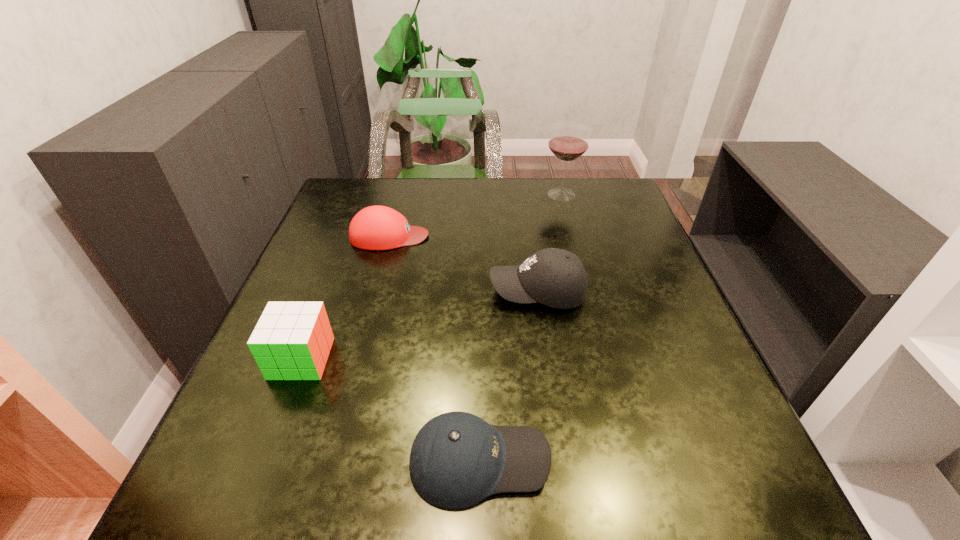
The width and height of the screenshot is (960, 540). In order to click on the farthest object in this screenshot , I will do `click(568, 141)`.

In order to click on wineglass in this screenshot , I will do `click(568, 141)`.

Find the location of a particular element. the third nearest object is located at coordinates click(x=554, y=277).

Where is `the tallest baseball cap`? This screenshot has height=540, width=960. the tallest baseball cap is located at coordinates (554, 277).

In order to click on the fourth farthest object in this screenshot , I will do `click(292, 340)`.

Locate an element on the screen. The width and height of the screenshot is (960, 540). the fourth nearest object is located at coordinates (377, 227).

Locate an element on the screen. This screenshot has width=960, height=540. the leftmost baseball cap is located at coordinates click(x=377, y=227).

The image size is (960, 540). Identify the location of the nearest baseball cap. (457, 459).

Identify the location of vacant space located on the front of the farthest object. (580, 263).

Find the location of `vacant space located 0.190m on the front-facing side of the second nearest baseball cap`. vacant space located 0.190m on the front-facing side of the second nearest baseball cap is located at coordinates (405, 292).